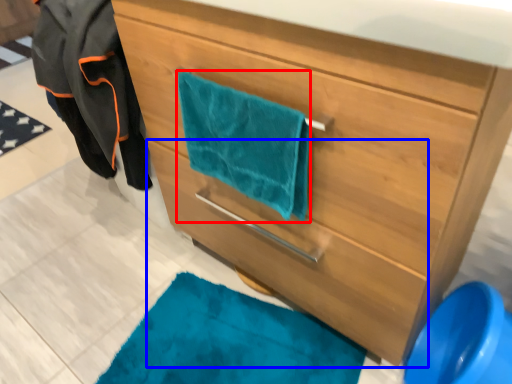
Question: Which point is closer to the camera, beach towel (highlighted by a red box) or drawer (highlighted by a blue box)?

Choices:
 (A) beach towel
 (B) drawer

Answer: (B)